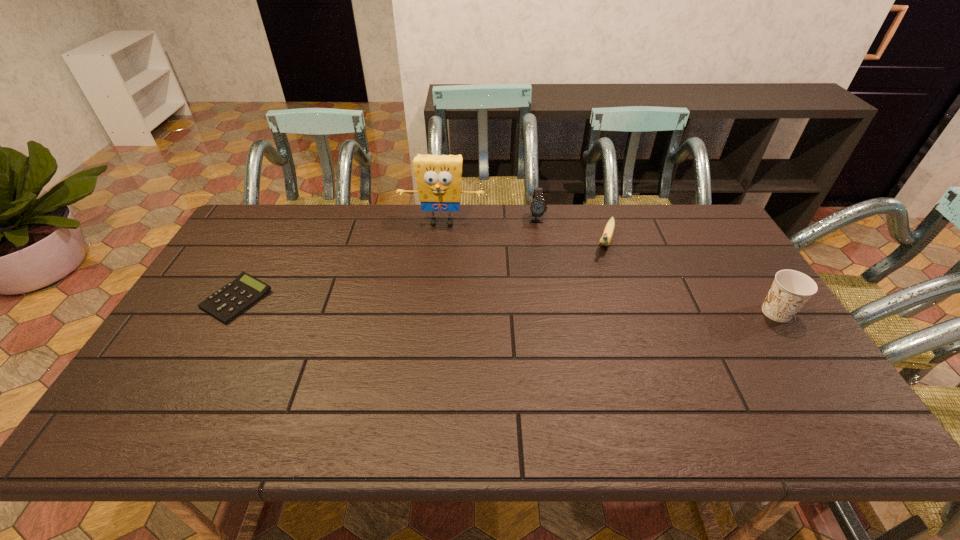
Find the location of a particular element. the leftmost object is located at coordinates (227, 303).

Identify the location of the shortest object. Image resolution: width=960 pixels, height=540 pixels. (227, 303).

Locate an element on the screen. the rightmost object is located at coordinates [x=791, y=289].

This screenshot has height=540, width=960. In order to click on the second shortest object in this screenshot , I will do `click(607, 235)`.

Identify the location of banana. (607, 235).

Locate an element on the screen. Image resolution: width=960 pixels, height=540 pixels. the second object from left to right is located at coordinates (438, 178).

Where is `sponge`? sponge is located at coordinates (438, 178).

The image size is (960, 540). Find the location of `the third object from right to left`. the third object from right to left is located at coordinates (538, 207).

This screenshot has height=540, width=960. What are the coordinates of `free space located 0.200m on the front of the shortest object` in the screenshot? It's located at click(x=186, y=389).

This screenshot has height=540, width=960. What are the coordinates of `free space located 0.070m on the front of the Dixie cup` in the screenshot? It's located at (799, 347).